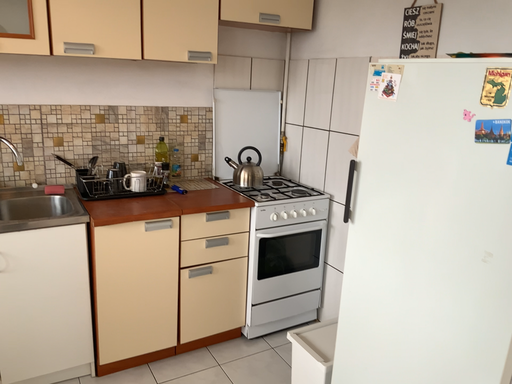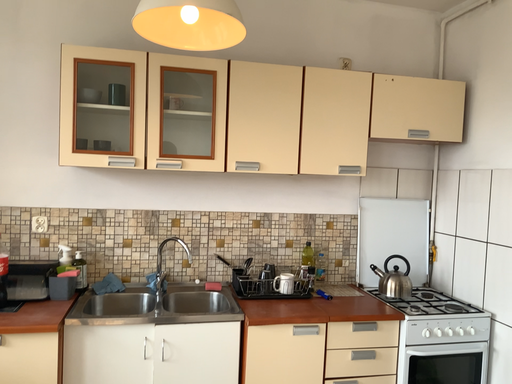
Question: How did the camera likely rotate when shooting the video?

Choices:
 (A) rotated right
 (B) rotated left

Answer: (B)